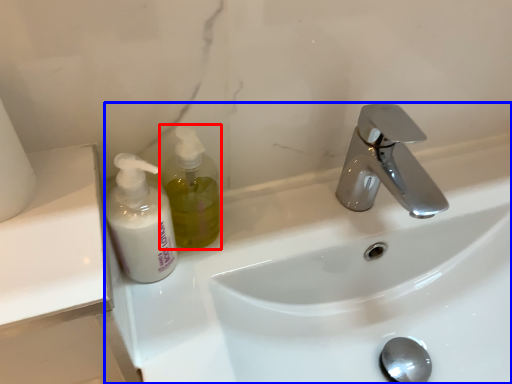
Question: Among these objects, which one is nearest to the camera, soap dispenser (highlighted by a red box) or sink (highlighted by a blue box)?

Choices:
 (A) soap dispenser
 (B) sink

Answer: (B)